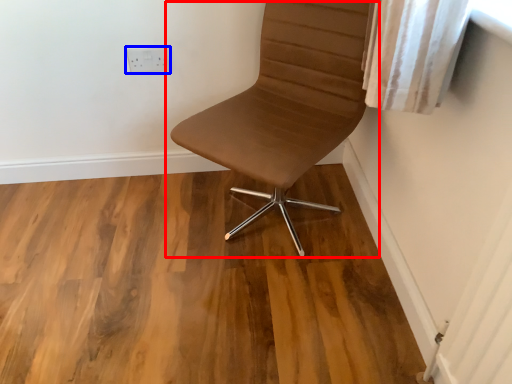
Question: Which object is closer to the camera taking this photo, chair (highlighted by a red box) or electric outlet (highlighted by a blue box)?

Choices:
 (A) chair
 (B) electric outlet

Answer: (A)